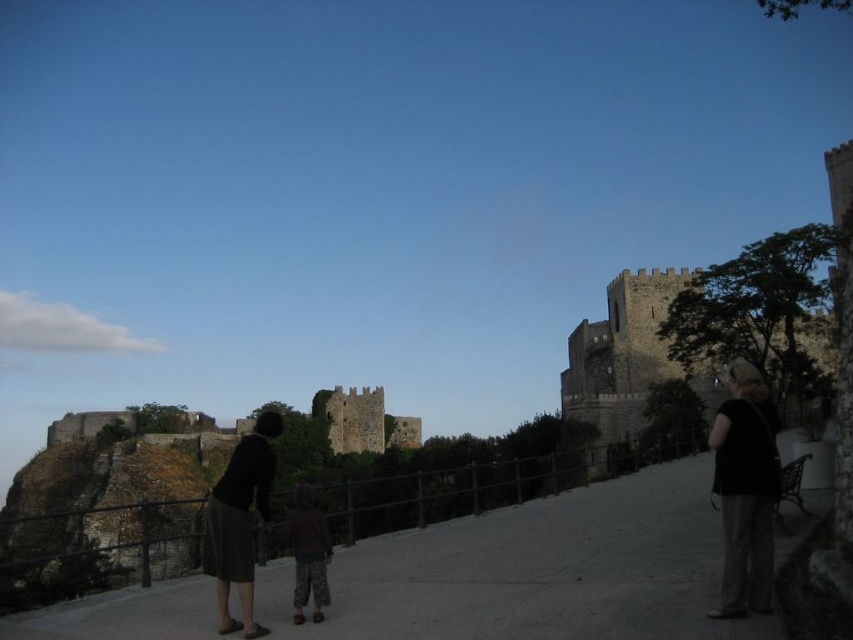
Looking at this image, you are standing on the pathway leading to the castle and see the dark stone castle at upper center and the dark gray skirt at lower center. Which object is higher in the image?

The dark stone castle at upper center is above the dark gray skirt at lower center in the image.

You are a photographer standing on the castle pathway and want to capture a photo of the two adults and the child. The camera you are using has a limited field of view. Based on their clothing, which of the two adults has a narrower clothing item between the black fabric at right and the dark gray skirt at lower center?

The black fabric at right has a lesser width compared to the dark gray skirt at lower center, so the adult wearing the black fabric at right has the narrower clothing item.